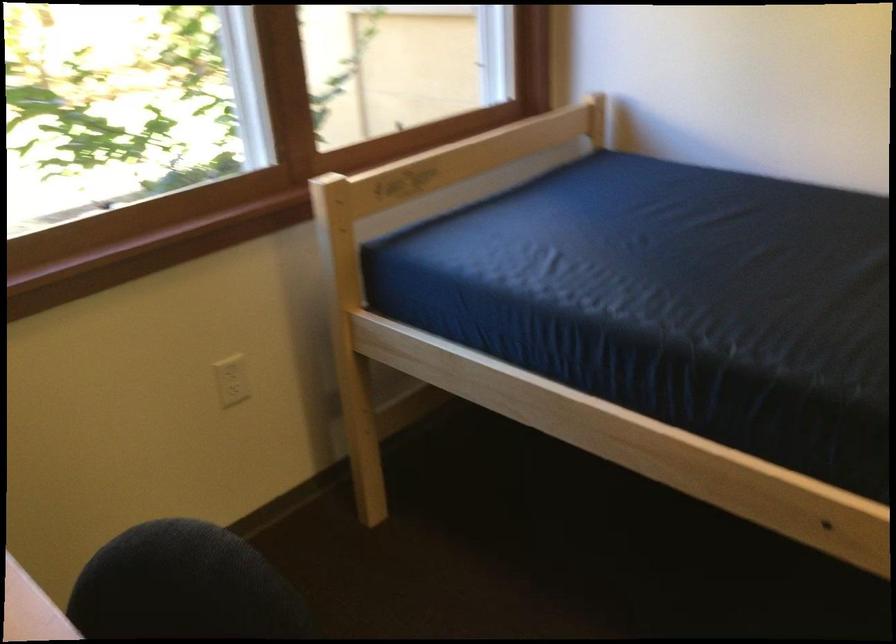
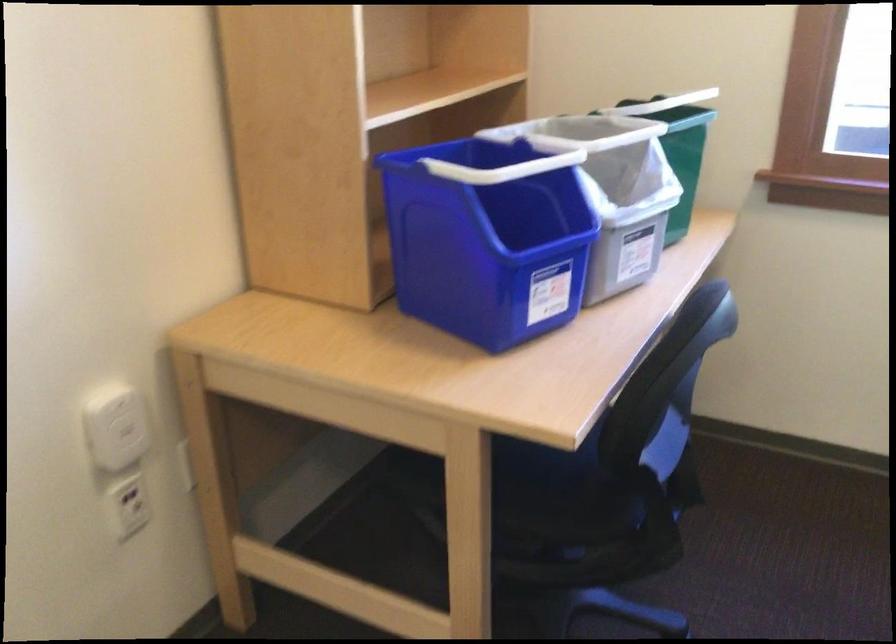
Based on the continuous images, in which direction is the camera rotating?

The camera rotated toward left-down.